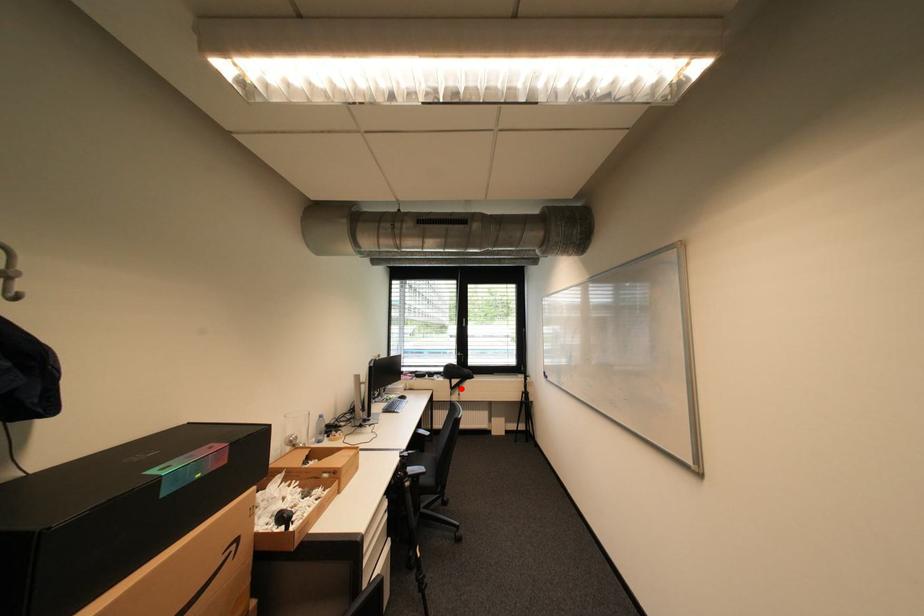
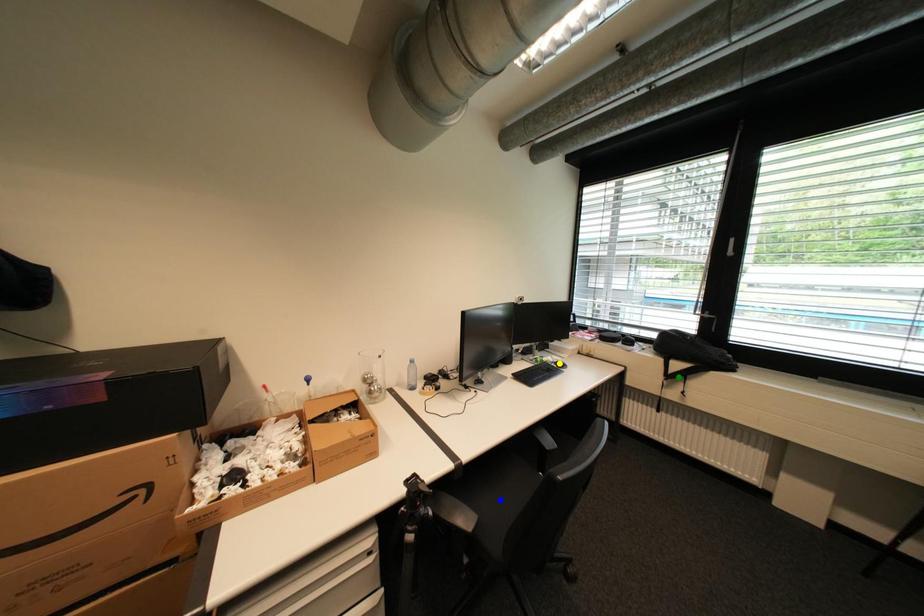
Question: I am providing you with two images of the same scene from different viewpoints. A red point is marked on the first image. You are given multiple points on the second image. Which point in image 2 represents the same 3d spot as the red point in image 1?

Choices:
 (A) blue point
 (B) yellow point
 (C) green point

Answer: (C)